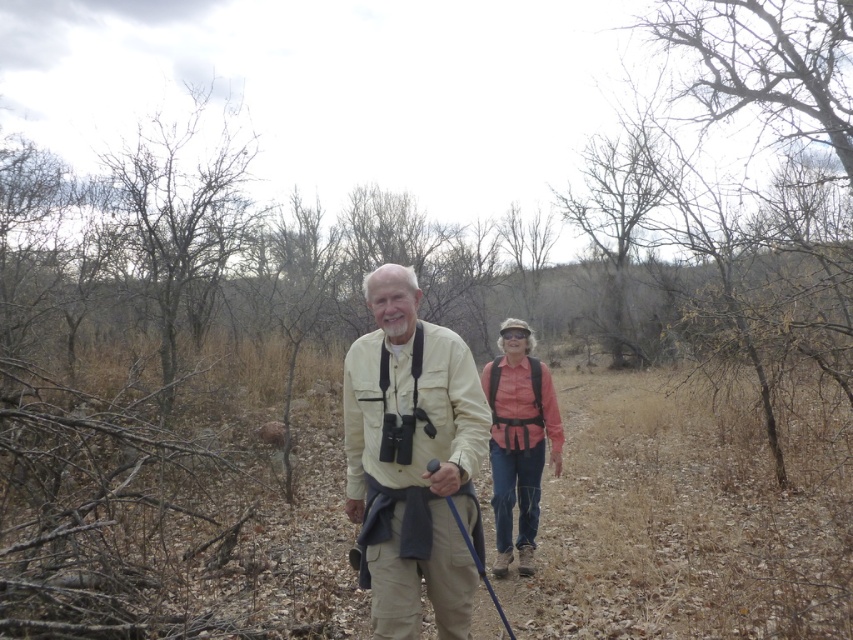
From the picture: You are a hiker who wants to identify which hiker is closer to you based on their clothing. The beige fabric shirt at center and the pink fabric shirt at center are both visible. Which shirt is larger in size?

The beige fabric shirt at center is larger in size than the pink fabric shirt at center.